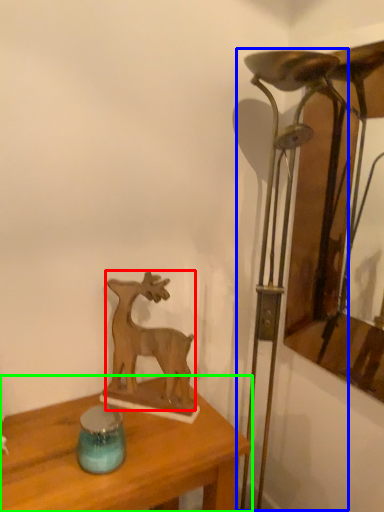
Question: Which object is the closest to the deer (highlighted by a red box)? Choose among these: table lamp (highlighted by a blue box) or table (highlighted by a green box).

Choices:
 (A) table lamp
 (B) table

Answer: (B)